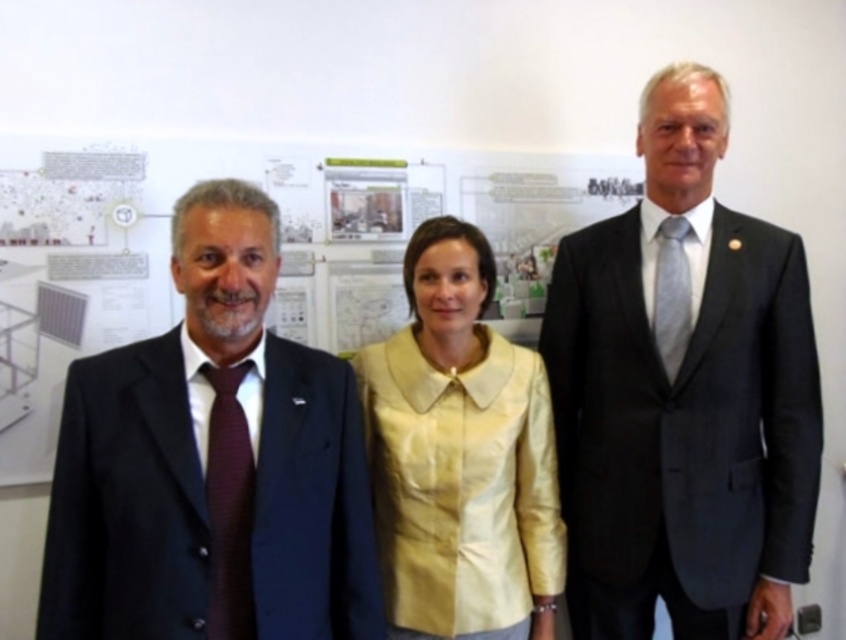
Question: Which point is farther from the camera taking this photo?

Choices:
 (A) (427, 241)
 (B) (226, 522)

Answer: (A)

Question: Is matte yellow blouse at center in front of light gray silk tie at right?

Choices:
 (A) no
 (B) yes

Answer: (B)

Question: Which is nearer to the dark blue suit at center?

Choices:
 (A) matte yellow blouse at center
 (B) light gray silk tie at right

Answer: (A)

Question: Which object is closer to the camera taking this photo?

Choices:
 (A) maroon textured tie at left
 (B) dark blue suit at center
 (C) light gray silk tie at right
 (D) dark gray suit at center

Answer: (B)

Question: Does dark blue suit at center appear on the left side of light gray silk tie at right?

Choices:
 (A) yes
 (B) no

Answer: (A)

Question: In this image, where is maroon textured tie at left located relative to light gray silk tie at right?

Choices:
 (A) left
 (B) right

Answer: (A)